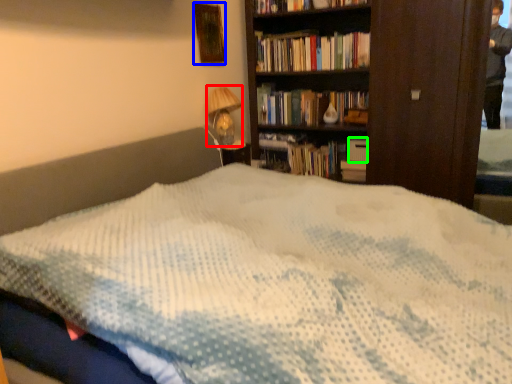
Question: Considering the real-world distances, which object is farthest from table lamp (highlighted by a red box)? picture frame (highlighted by a blue box) or paperback book (highlighted by a green box)?

Choices:
 (A) picture frame
 (B) paperback book

Answer: (B)